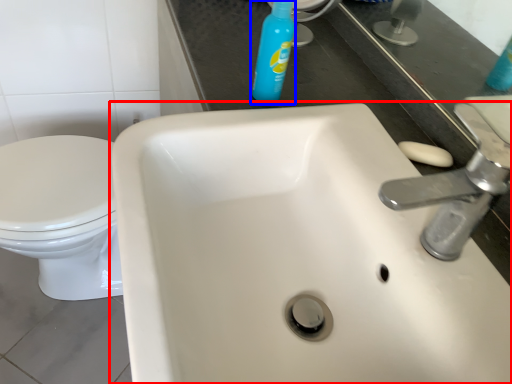
Question: Which point is closer to the camera, sink (highlighted by a red box) or cleaning product (highlighted by a blue box)?

Choices:
 (A) sink
 (B) cleaning product

Answer: (A)